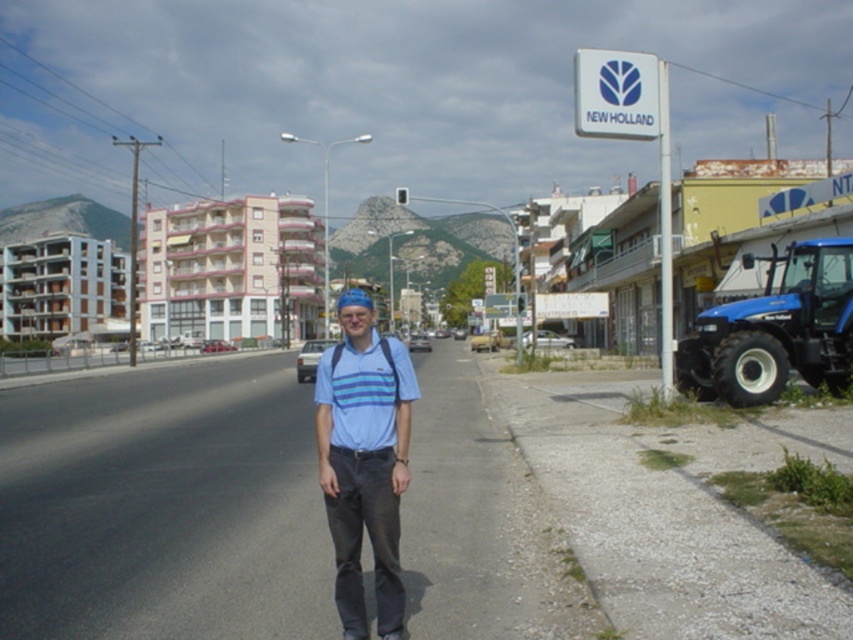
You are a delivery person who needs to place a large package on the sidewalk. The package is as big as the blue rubber tractor at right. Is there enough space between the blue striped polo shirt at center and the nearby buildings to safely place it there?

The blue rubber tractor at right is smaller than the blue striped polo shirt at center. Since the package is as big as the tractor, it should fit in the space between the shirt and the buildings, but you should check the exact dimensions to be sure.